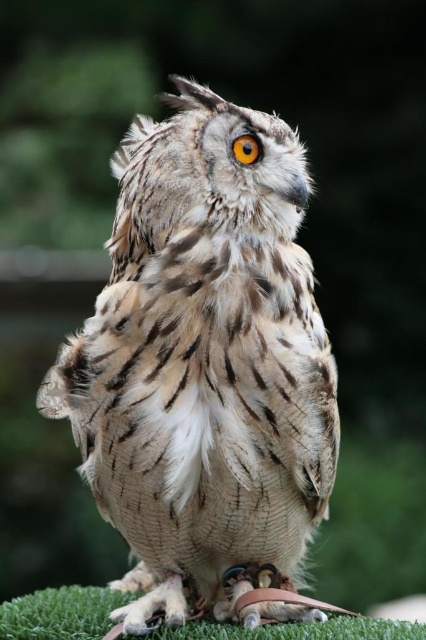
Question: Does brown feathered owl at center have a smaller size compared to green artificial turf at lower center?

Choices:
 (A) yes
 (B) no

Answer: (B)

Question: Based on their relative distances, which object is farther from the green artificial turf at lower center?

Choices:
 (A) orange fur eye at center
 (B) brown feathered owl at center

Answer: (A)

Question: Which object appears closest to the camera in this image?

Choices:
 (A) orange fur eye at center
 (B) green artificial turf at lower center

Answer: (B)

Question: Is green artificial turf at lower center below orange fur eye at center?

Choices:
 (A) yes
 (B) no

Answer: (A)

Question: Which point is closer to the camera?

Choices:
 (A) (221, 624)
 (B) (239, 141)
 (C) (183, 532)

Answer: (A)

Question: Is green artificial turf at lower center further to camera compared to orange fur eye at center?

Choices:
 (A) no
 (B) yes

Answer: (A)